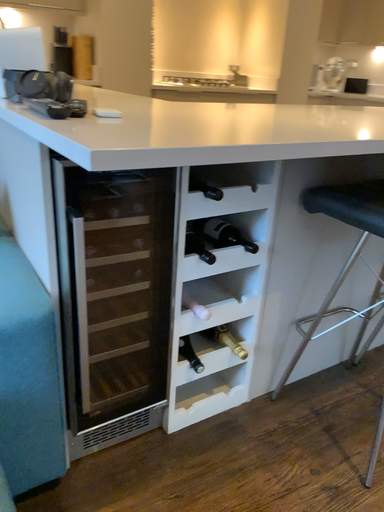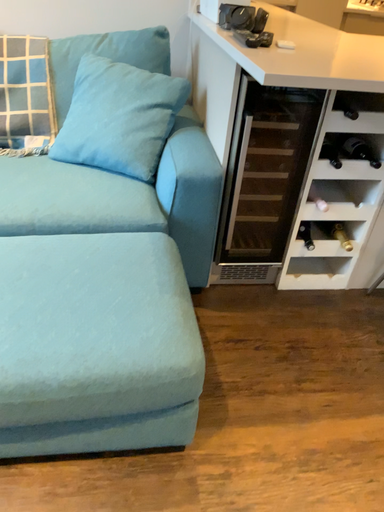
Question: Which way did the camera rotate in the video?

Choices:
 (A) rotated upward
 (B) rotated downward

Answer: (B)